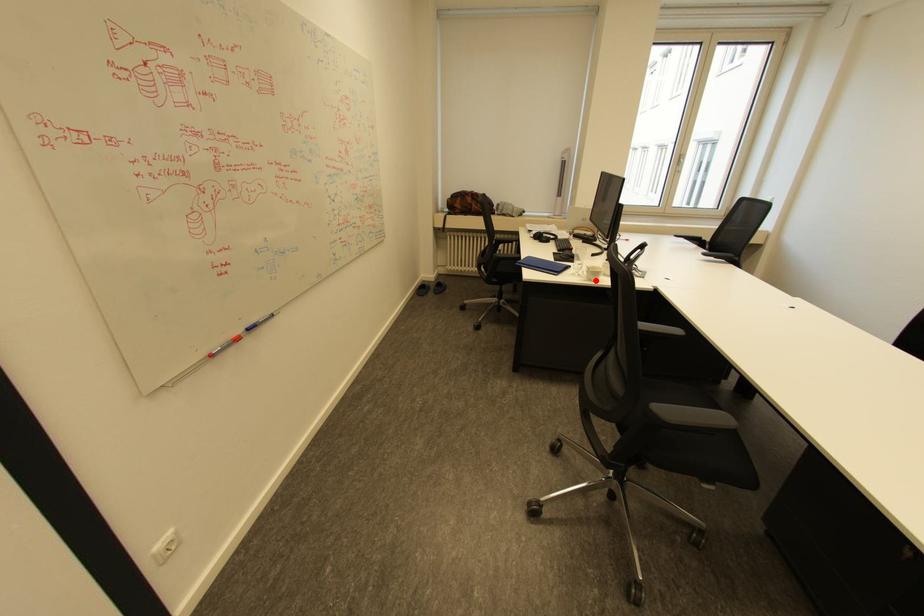
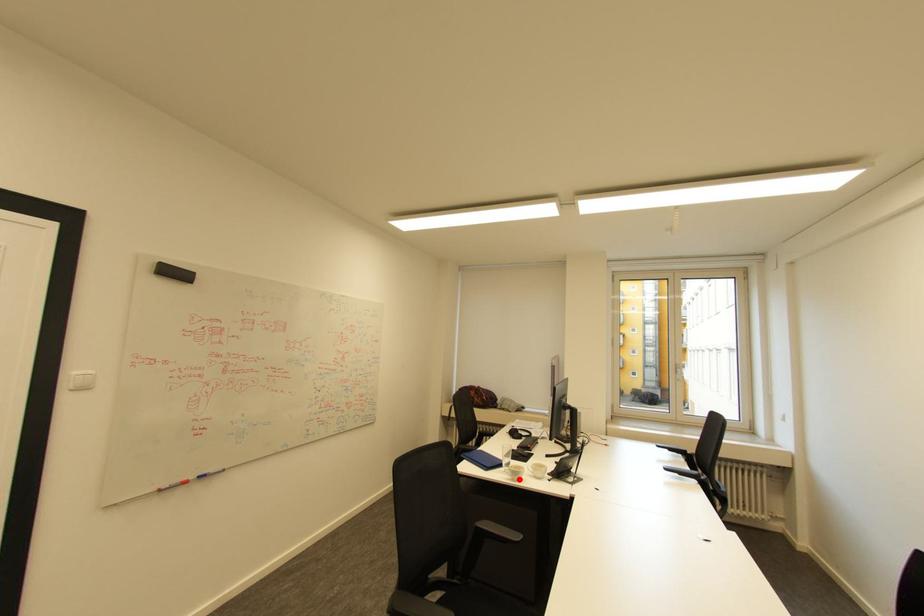
From the picture: I am providing you with two images of the same scene from different viewpoints. A red point is marked on the first image and another point is marked on the second image. Are the points marked in image1 and image2 representing the same 3D position?

Yes